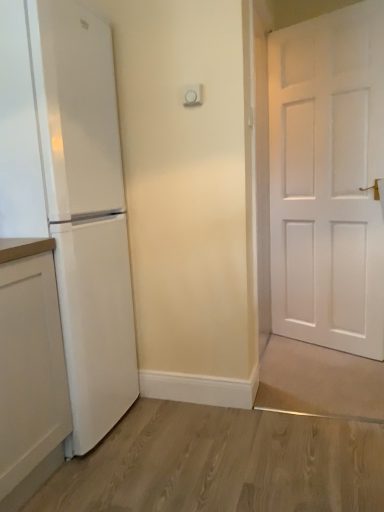
Question: Considering the positions of white matte refrigerator at left and white matte cabinet at left in the image, is white matte refrigerator at left taller or shorter than white matte cabinet at left?

Choices:
 (A) tall
 (B) short

Answer: (A)

Question: From the image's perspective, is white matte refrigerator at left positioned above or below white matte cabinet at left?

Choices:
 (A) below
 (B) above

Answer: (B)

Question: In the image, is white matte refrigerator at left on the left side or the right side of white matte cabinet at left?

Choices:
 (A) right
 (B) left

Answer: (A)

Question: From the image's perspective, is white matte cabinet at left located above or below white matte refrigerator at left?

Choices:
 (A) below
 (B) above

Answer: (A)

Question: Is white matte cabinet at left to the left or to the right of white matte refrigerator at left in the image?

Choices:
 (A) right
 (B) left

Answer: (B)

Question: In the image, is white matte cabinet at left positioned in front of or behind white matte refrigerator at left?

Choices:
 (A) behind
 (B) front

Answer: (B)

Question: From a real-world perspective, is white matte cabinet at left physically located above or below white matte refrigerator at left?

Choices:
 (A) below
 (B) above

Answer: (A)